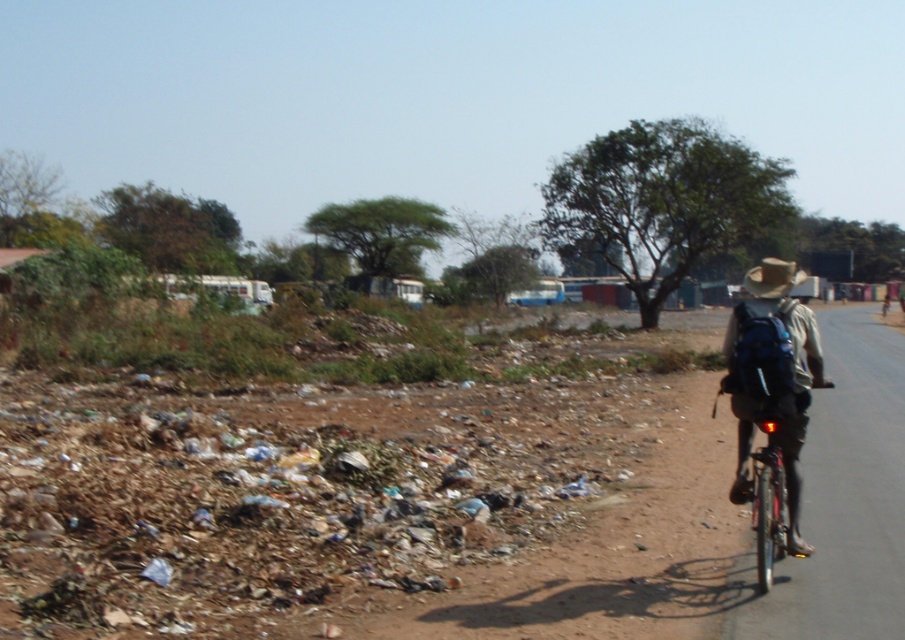
Question: Does shiny metallic bicycle at right have a greater width compared to brown straw hat at right?

Choices:
 (A) yes
 (B) no

Answer: (B)

Question: Does shiny metallic bicycle at right have a greater width compared to brown straw hat at right?

Choices:
 (A) no
 (B) yes

Answer: (A)

Question: Among these points, which one is nearest to the camera?

Choices:
 (A) (768, 566)
 (B) (758, 268)

Answer: (A)

Question: Which point is closer to the camera taking this photo?

Choices:
 (A) (757, 547)
 (B) (767, 278)

Answer: (A)

Question: Can you confirm if shiny metallic bicycle at right is positioned to the right of brown straw hat at right?

Choices:
 (A) yes
 (B) no

Answer: (B)